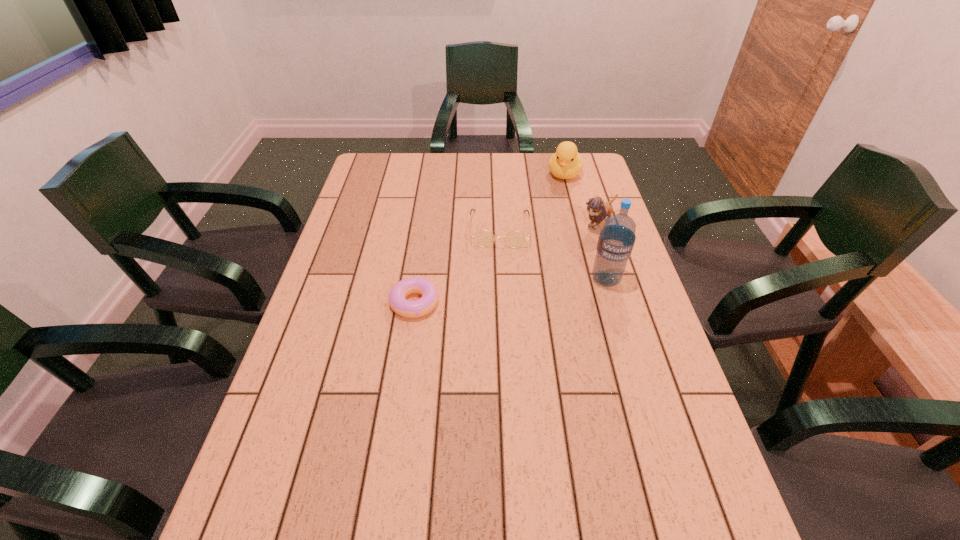
The image size is (960, 540). Identify the location of empty location between the kitten and the spectacles. (549, 226).

Find the location of a particular element. free spot between the fourth tallest object and the water bottle is located at coordinates (553, 254).

Locate an element on the screen. The width and height of the screenshot is (960, 540). free space between the tallest object and the second object from left to right is located at coordinates (553, 254).

This screenshot has height=540, width=960. I want to click on unoccupied position between the kitten and the farthest object, so click(581, 199).

You are a GUI agent. You are given a task and a screenshot of the screen. Output one action in this format:
    pyautogui.click(x=<x>, y=<y>)
    Task: Click on the free space between the third shortest object and the duck
    
    Given the screenshot: What is the action you would take?
    pyautogui.click(x=581, y=199)

This screenshot has height=540, width=960. Find the location of `blank region between the third shortest object and the leftmost object`. blank region between the third shortest object and the leftmost object is located at coordinates click(x=507, y=262).

You are a GUI agent. You are given a task and a screenshot of the screen. Output one action in this format:
    pyautogui.click(x=<x>, y=<y>)
    Task: Click on the empty space that is in between the third tallest object and the shortest object
    The width and height of the screenshot is (960, 540).
    Given the screenshot: What is the action you would take?
    pyautogui.click(x=507, y=262)

At what (x,y) coordinates should I click in order to perform the action: click on vacant area that lies between the spectacles and the doughnut. Please return your answer as a coordinate pair (x, y). This screenshot has width=960, height=540. Looking at the image, I should click on (457, 266).

Identify which object is located as the second nearest to the spectacles. Please provide its 2D coordinates. Your answer should be formatted as a tuple, i.e. [(x, y)], where the tuple contains the x and y coordinates of a point satisfying the conditions above.

[(411, 309)]

Select which object appears as the second closest to the duck. Please provide its 2D coordinates. Your answer should be formatted as a tuple, i.e. [(x, y)], where the tuple contains the x and y coordinates of a point satisfying the conditions above.

[(483, 238)]